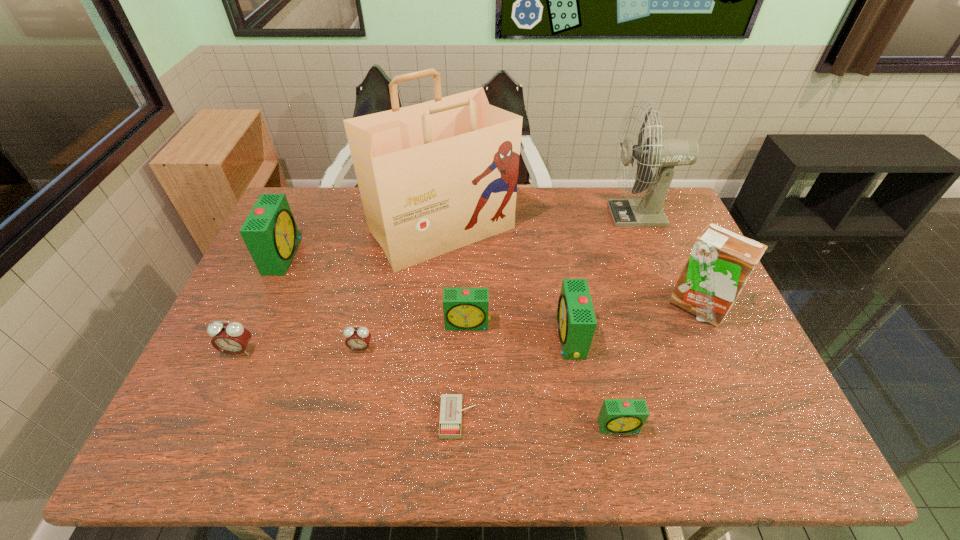
At what (x,y) coordinates should I click in order to perform the action: click on the third green alarm clock from right to left. Please return your answer as a coordinate pair (x, y). Looking at the image, I should click on (464, 308).

I want to click on the second smallest green alarm clock, so click(x=464, y=308).

This screenshot has width=960, height=540. Find the location of `the third alarm clock from left to right`. the third alarm clock from left to right is located at coordinates (358, 339).

You are a GUI agent. You are given a task and a screenshot of the screen. Output one action in this format:
    pyautogui.click(x=<x>, y=<y>)
    Task: Click on the right pink alarm clock
    The width and height of the screenshot is (960, 540).
    Given the screenshot: What is the action you would take?
    pyautogui.click(x=358, y=339)

In order to click on the nearest alarm clock in this screenshot , I will do `click(616, 415)`.

Identify the location of the nearest green alarm clock. This screenshot has width=960, height=540. (616, 415).

Identify the location of white matchbox. Image resolution: width=960 pixels, height=540 pixels. (450, 423).

Locate an element on the screen. This screenshot has width=960, height=540. the shortest object is located at coordinates (450, 423).

Where is `blank area located on the side of the tallest object with the superhero design`? The height and width of the screenshot is (540, 960). blank area located on the side of the tallest object with the superhero design is located at coordinates (429, 372).

In order to click on vacant region located on the air flow direction of the ninth shortest object in this screenshot , I will do `click(563, 214)`.